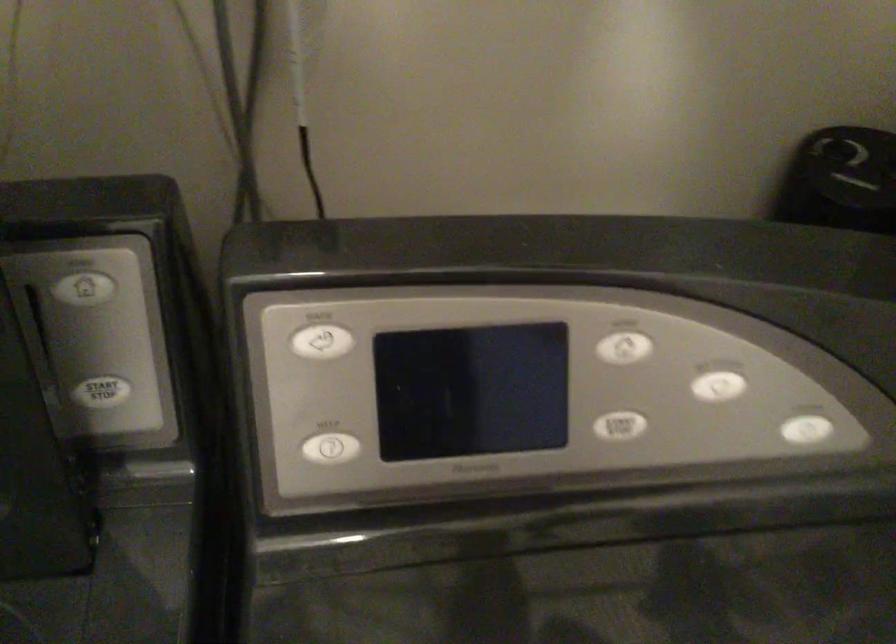
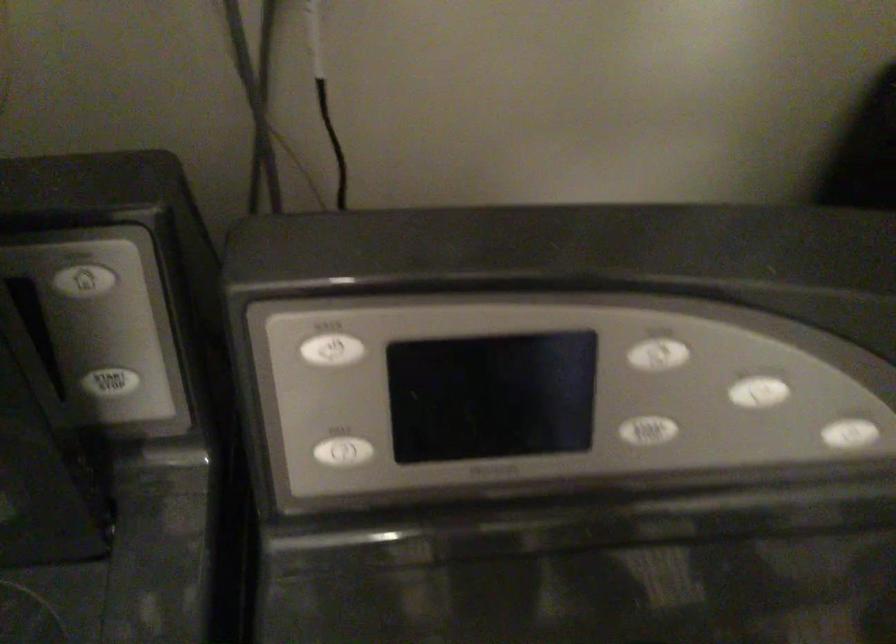
In the second image, find the point that corresponds to pixel 317 455 in the first image.

(332, 458)